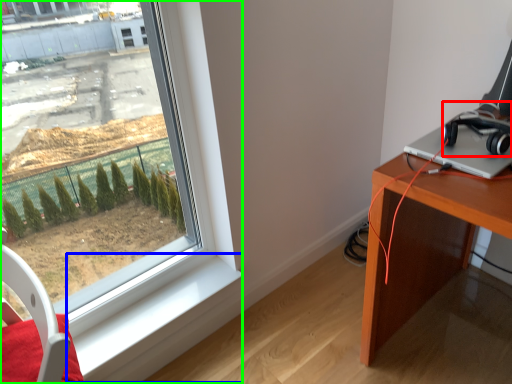
Question: Which object is positioned farthest from headphones (highlighted by a red box)? Select from window sill (highlighted by a blue box) and window (highlighted by a green box).

Choices:
 (A) window sill
 (B) window

Answer: (A)